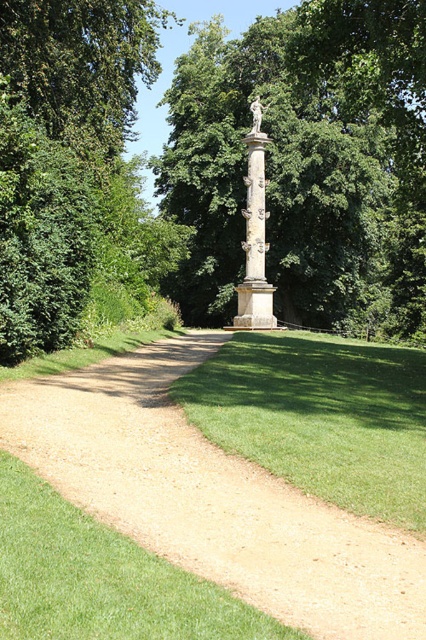
Question: Which point is farther from the camera taking this photo?

Choices:
 (A) (238, 300)
 (B) (268, 104)
 (C) (175, 202)

Answer: (C)

Question: Is green grass at center wider than beige stone column at center?

Choices:
 (A) no
 (B) yes

Answer: (B)

Question: From the image, what is the correct spatial relationship of green leafy tree at center in relation to beige stone column at center?

Choices:
 (A) above
 (B) below

Answer: (A)

Question: Can you confirm if brown gravel path at center is positioned below white marble statue at center?

Choices:
 (A) yes
 (B) no

Answer: (A)

Question: Which object appears closest to the camera in this image?

Choices:
 (A) green leafy tree at center
 (B) green grass at center
 (C) brown gravel path at center

Answer: (C)

Question: Which point is farther to the camera?

Choices:
 (A) (256, 291)
 (B) (334, 532)
 (C) (256, 122)
 (D) (282, 406)

Answer: (C)